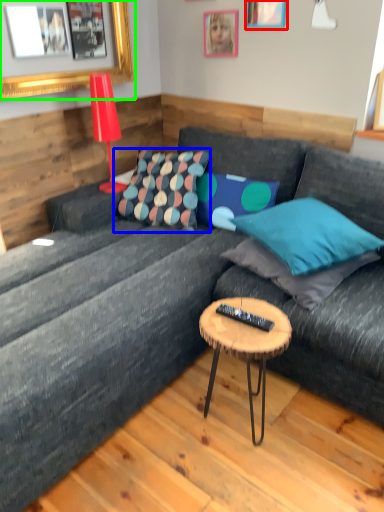
Question: Considering the real-world distances, which object is farthest from picture frame (highlighted by a red box)? pillow (highlighted by a blue box) or picture frame (highlighted by a green box)?

Choices:
 (A) pillow
 (B) picture frame

Answer: (A)